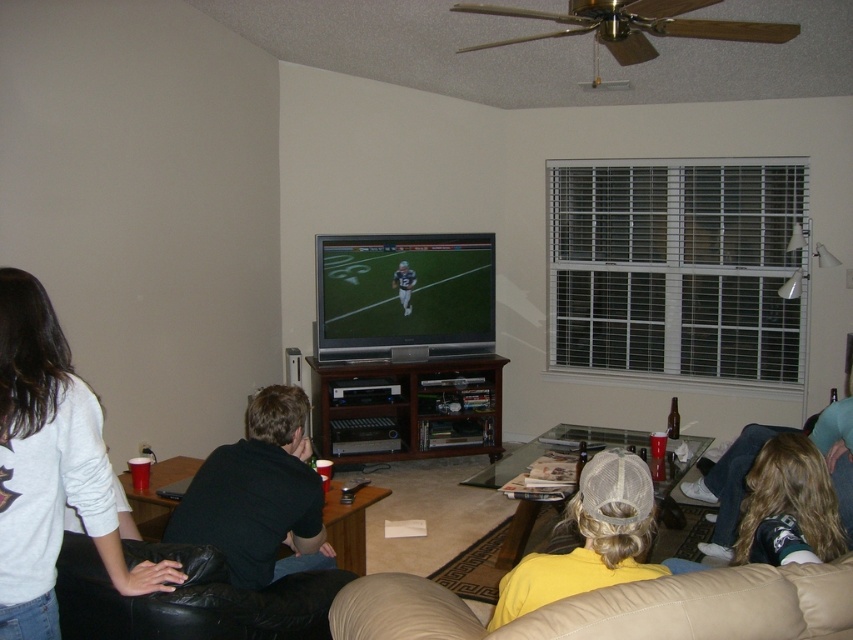
Question: Does white cotton shirt at lower left have a smaller size compared to beige leather couch at lower right?

Choices:
 (A) no
 (B) yes

Answer: (B)

Question: Is white cotton shirt at lower left closer to camera compared to black leather couch at lower left?

Choices:
 (A) no
 (B) yes

Answer: (B)

Question: Which object is closer to the camera taking this photo?

Choices:
 (A) white cotton shirt at lower left
 (B) black cotton shirt at center
 (C) yellow mesh cap at lower center
 (D) black leather couch at lower left

Answer: (C)

Question: Where is white cotton shirt at lower left located in relation to black leather couch at lower left in the image?

Choices:
 (A) below
 (B) above

Answer: (B)

Question: Which of the following is the closest to the observer?

Choices:
 (A) (311, 548)
 (B) (641, 572)

Answer: (B)

Question: Based on their relative distances, which object is nearer to the black cotton shirt at center?

Choices:
 (A) beige leather couch at lower right
 (B) yellow mesh cap at lower center
 (C) white cotton shirt at lower left
 (D) black leather couch at lower left

Answer: (D)